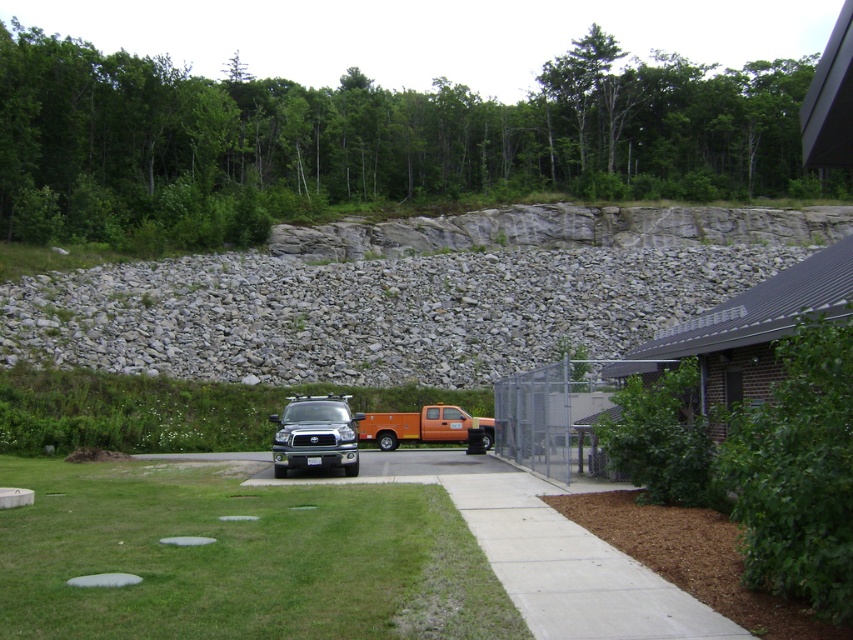
Question: Which of the following is the farthest from the observer?

Choices:
 (A) green grass at lower left
 (B) matte black truck at center

Answer: (B)

Question: Can you confirm if green grass at lower left is positioned to the left of orange matte truck at center?

Choices:
 (A) no
 (B) yes

Answer: (B)

Question: Can you confirm if green grass at lower left is positioned above matte black truck at center?

Choices:
 (A) yes
 (B) no

Answer: (B)

Question: Can you confirm if green grass at lower left is positioned to the left of orange matte truck at center?

Choices:
 (A) yes
 (B) no

Answer: (A)

Question: Which of the following is the farthest from the observer?

Choices:
 (A) (469, 426)
 (B) (370, 518)

Answer: (A)

Question: Which object appears farthest from the camera in this image?

Choices:
 (A) green grass at lower left
 (B) orange matte truck at center

Answer: (B)